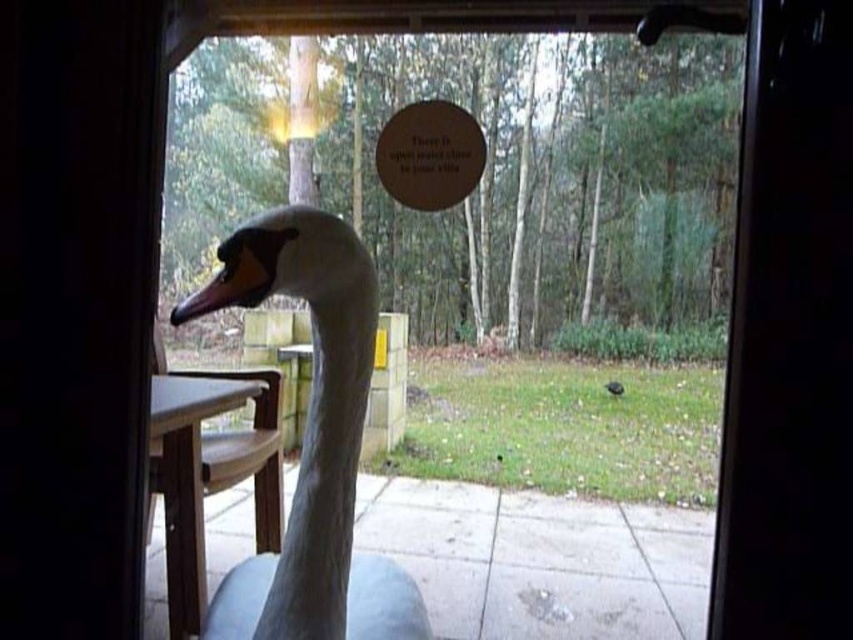
You are standing inside the house and want to exit through the transparent glass screen door at center. Based on the coordinates provided, is the door located closer to the top or bottom of the frame?

The transparent glass screen door at center is located closer to the bottom of the frame since its y coordinate is 0.926, which is closer to 1.000 representing the bottom edge.